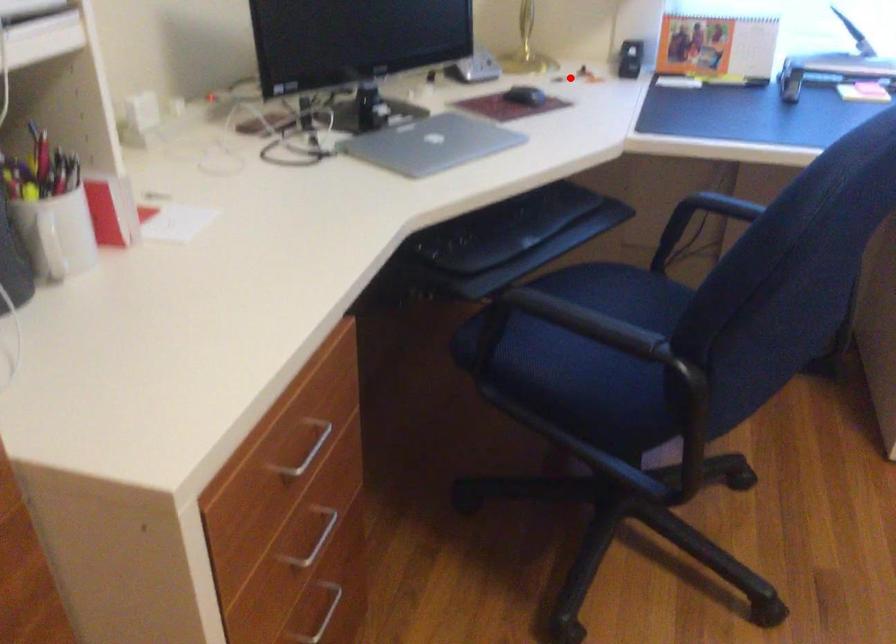
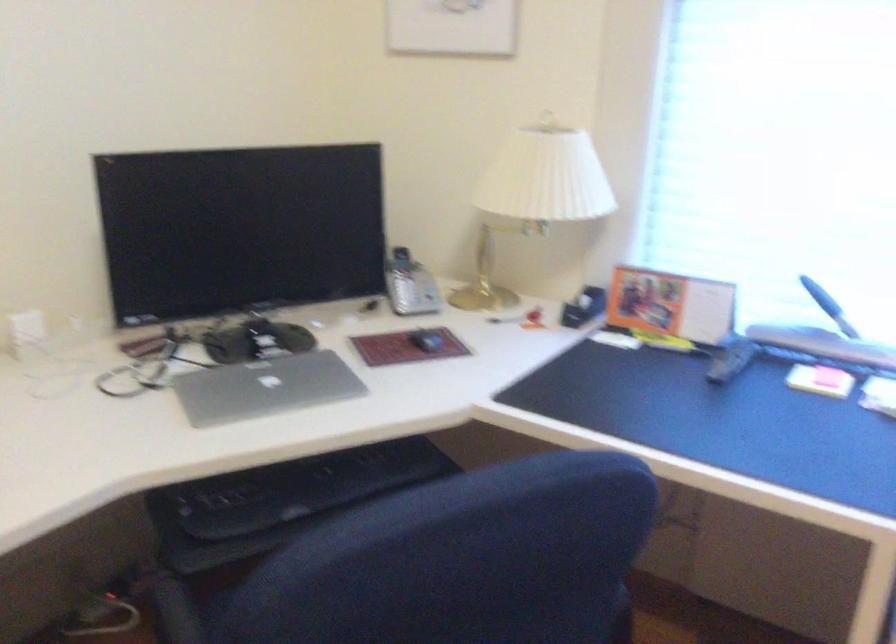
Where in the second image is the point corresponding to the highlighted location from the first image?

(504, 319)